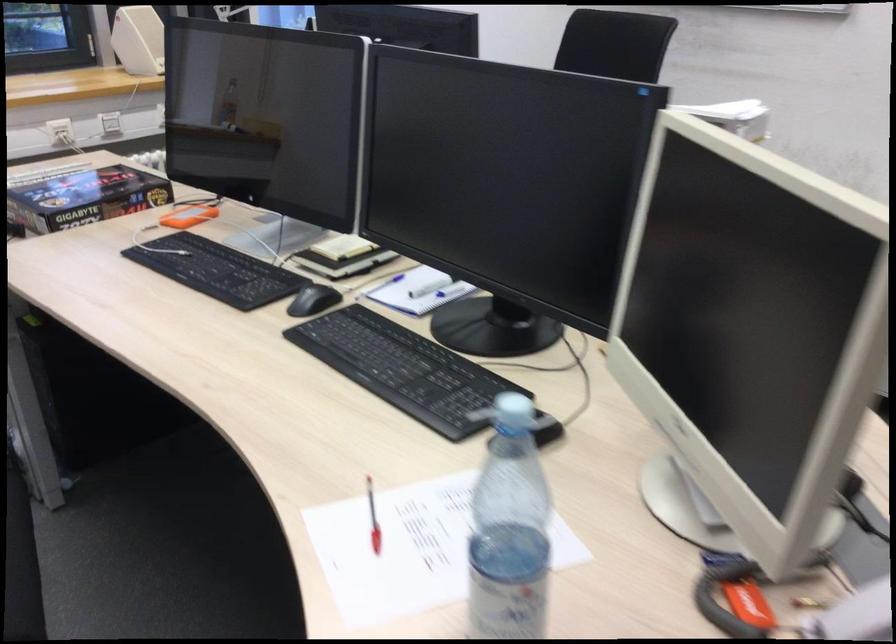
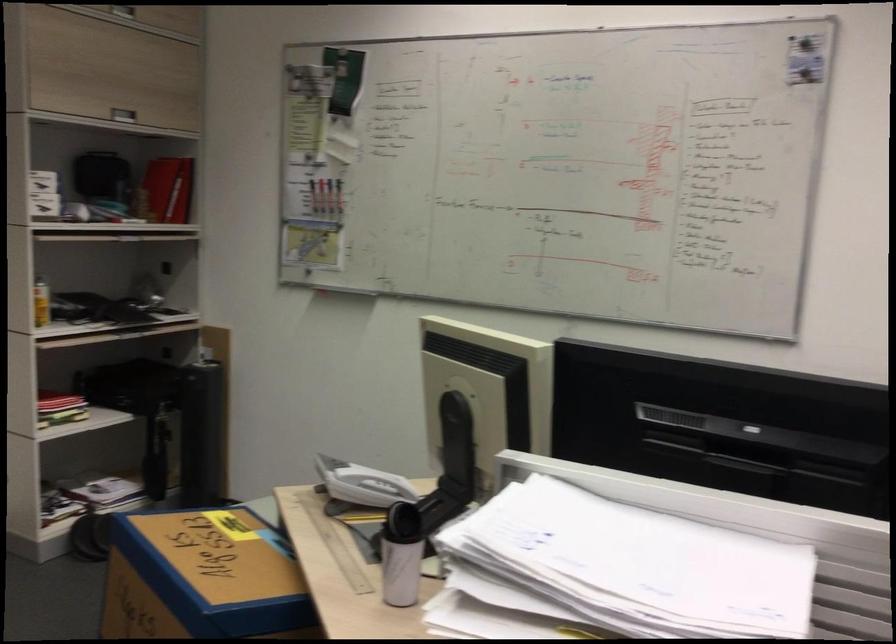
Question: I am providing you with two images of the same scene from different viewpoints. Which of the following objects are not visible in image2?

Choices:
 (A) small trash can
 (B) black storage case
 (C) blue bottle cap
 (D) yellow spray can

Answer: (C)